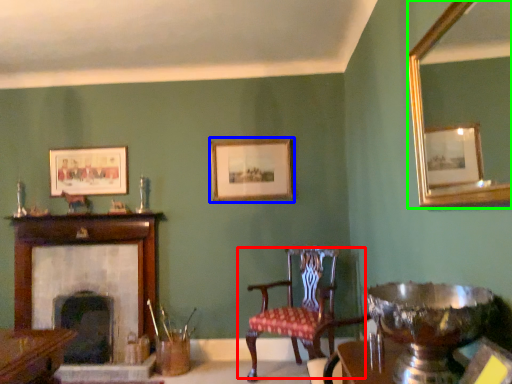
Question: Considering the real-world distances, which object is closest to chair (highlighted by a red box)? picture frame (highlighted by a blue box) or mirror (highlighted by a green box).

Choices:
 (A) picture frame
 (B) mirror

Answer: (A)